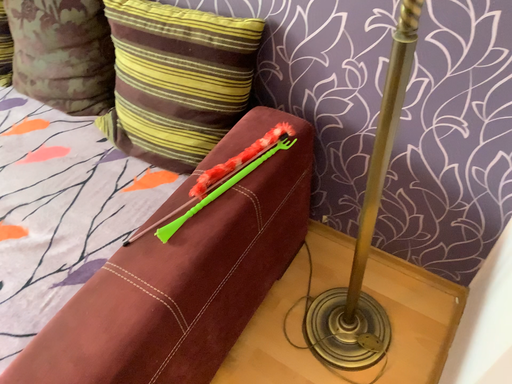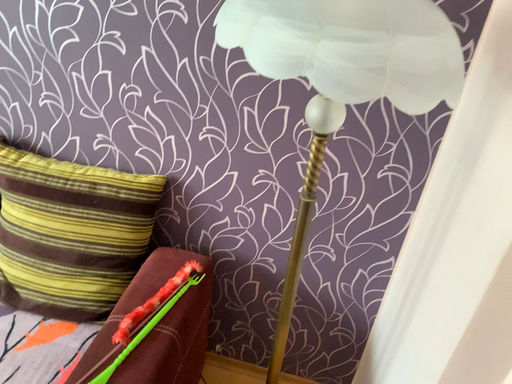
Question: How did the camera likely rotate when shooting the video?

Choices:
 (A) rotated downward
 (B) rotated upward

Answer: (B)